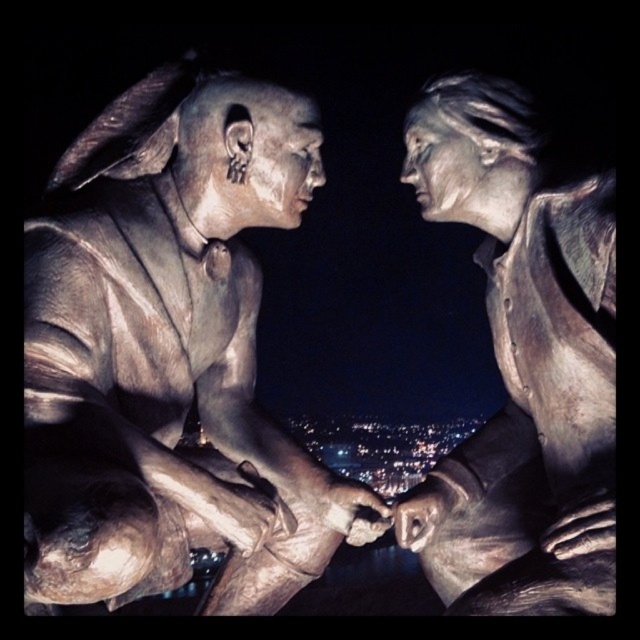
Question: Which object appears closest to the camera in this image?

Choices:
 (A) bronze statue at center
 (B) bronze statue at left

Answer: (B)

Question: Is bronze statue at left positioned in front of bronze statue at center?

Choices:
 (A) no
 (B) yes

Answer: (B)

Question: Does bronze statue at left have a smaller size compared to bronze statue at center?

Choices:
 (A) no
 (B) yes

Answer: (A)

Question: Does bronze statue at left have a lesser width compared to bronze statue at center?

Choices:
 (A) yes
 (B) no

Answer: (B)

Question: Among these objects, which one is farthest from the camera?

Choices:
 (A) bronze statue at center
 (B) bronze statue at left

Answer: (A)

Question: Which of the following is the closest to the observer?

Choices:
 (A) (580, 595)
 (B) (86, 352)

Answer: (A)